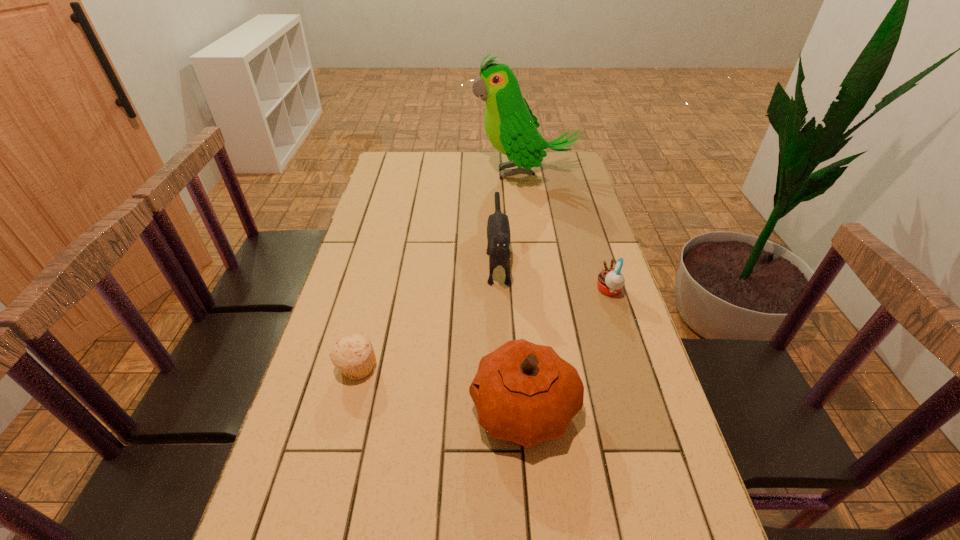
This screenshot has height=540, width=960. In order to click on parakeet located at the right edge in this screenshot , I will do `click(511, 127)`.

What are the coordinates of `muffin located in the right edge section of the desktop` in the screenshot? It's located at (610, 282).

This screenshot has height=540, width=960. Identify the location of object that is at the far right corner. (511, 127).

In the image, there is a desktop. At what (x,y) coordinates should I click in order to perform the action: click on free space at the far edge. Please return your answer as a coordinate pair (x, y). The height and width of the screenshot is (540, 960). Looking at the image, I should click on (448, 163).

Find the location of `vacant space at the left edge`. vacant space at the left edge is located at coordinates (401, 184).

Locate an element on the screen. free spot at the right edge of the desktop is located at coordinates (659, 485).

Locate an element on the screen. vacant space at the far right corner of the desktop is located at coordinates point(543,171).

Where is `vacant area that lies between the farther muffin and the pumpkin`? vacant area that lies between the farther muffin and the pumpkin is located at coordinates point(566,349).

What are the coordinates of `blank region between the farther muffin and the left muffin` in the screenshot? It's located at (483, 329).

Where is `empty space that is in between the right muffin and the left muffin`? Image resolution: width=960 pixels, height=540 pixels. empty space that is in between the right muffin and the left muffin is located at coordinates (483, 329).